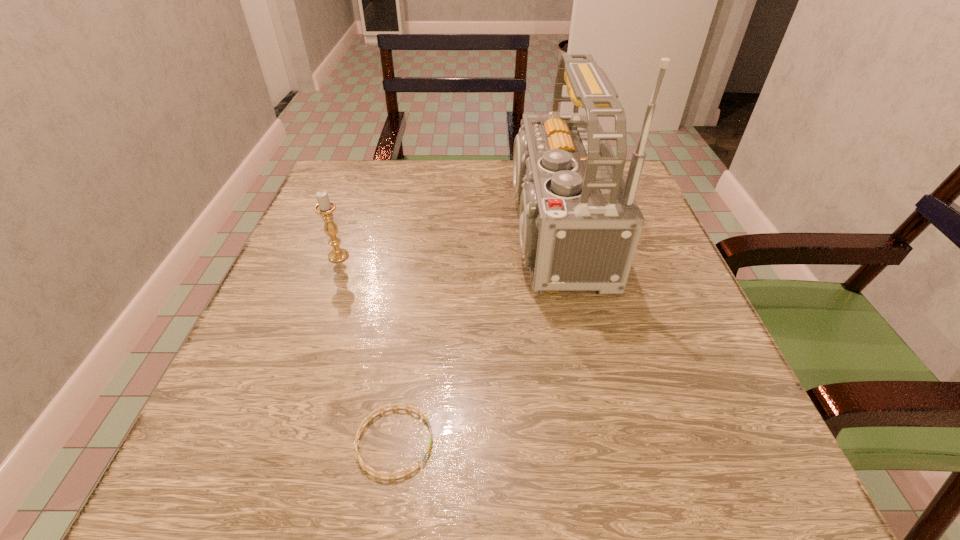
The height and width of the screenshot is (540, 960). I want to click on vacant region between the bracelet and the second shortest object, so click(x=367, y=349).

This screenshot has height=540, width=960. Identify the location of vacant region between the shortest object and the second tallest object. (367, 349).

Identify the location of object identified as the second closest to the second object from right to left. (325, 207).

Find the location of a particular element. object that is the closest to the tallest object is located at coordinates (378, 474).

Find the location of `blank space that satisfies the following two spatial constraints: 1. on the front-facing side of the radio receiver; 2. on the front side of the leftmost object`. blank space that satisfies the following two spatial constraints: 1. on the front-facing side of the radio receiver; 2. on the front side of the leftmost object is located at coordinates (547, 256).